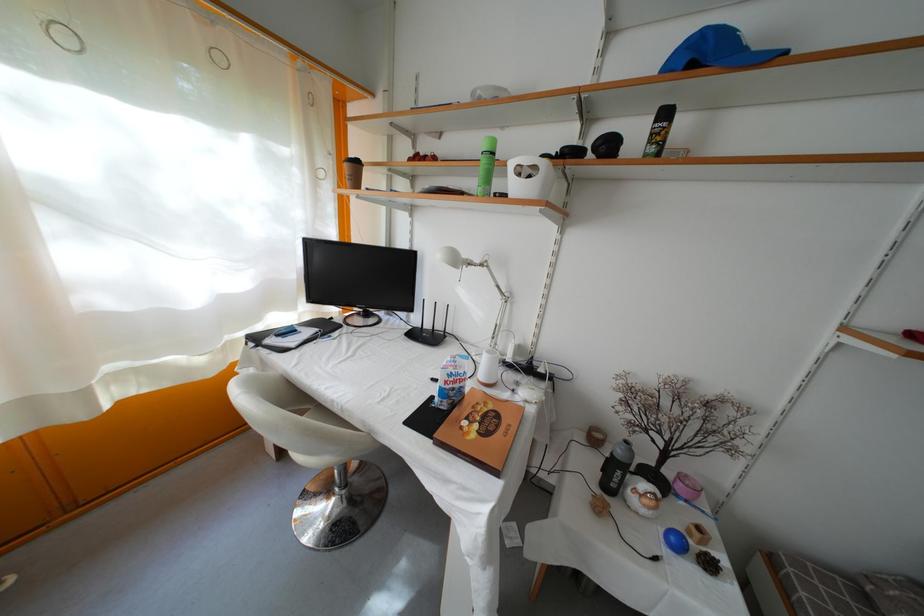
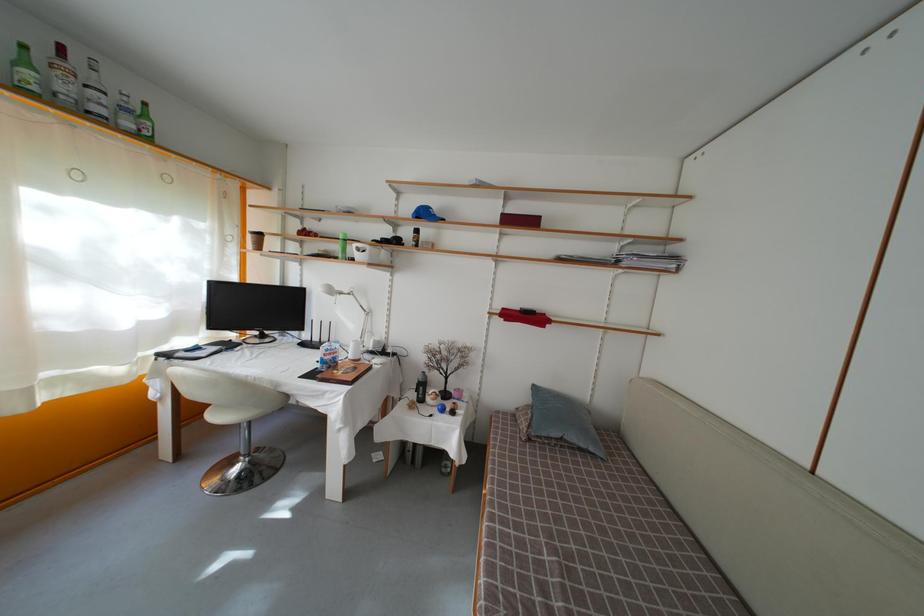
Find the pixel in the second image that matches point (708, 62) in the first image.

(430, 220)